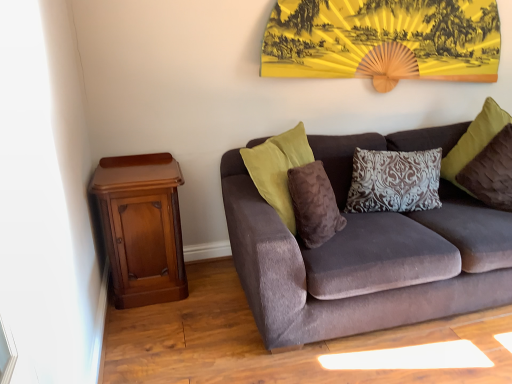
Question: Considering the relative sizes of brown fuzzy pillow at center, positioned as the first pillow in left-to-right order, and velvet brown couch at center in the image provided, is brown fuzzy pillow at center, positioned as the first pillow in left-to-right order, smaller than velvet brown couch at center?

Choices:
 (A) yes
 (B) no

Answer: (A)

Question: Is brown fuzzy pillow at center, positioned as the first pillow in left-to-right order, at the left side of velvet brown couch at center?

Choices:
 (A) no
 (B) yes

Answer: (B)

Question: Is brown fuzzy pillow at center, which ranks as the 3th pillow in right-to-left order, further to camera compared to velvet brown couch at center?

Choices:
 (A) yes
 (B) no

Answer: (A)

Question: Is brown fuzzy pillow at center, which ranks as the 3th pillow in right-to-left order, shorter than velvet brown couch at center?

Choices:
 (A) yes
 (B) no

Answer: (A)

Question: Is brown fuzzy pillow at center, which ranks as the 3th pillow in right-to-left order, next to velvet brown couch at center?

Choices:
 (A) yes
 (B) no

Answer: (B)

Question: Is brown fuzzy pillow at center, which ranks as the 3th pillow in right-to-left order, far from velvet brown couch at center?

Choices:
 (A) no
 (B) yes

Answer: (A)

Question: Is mahogany wood nightstand at left completely or partially inside velvet brown pillow at upper right, marked as the 1th pillow in a right-to-left arrangement?

Choices:
 (A) yes
 (B) no

Answer: (B)

Question: Is velvet brown pillow at upper right, marked as the 1th pillow in a right-to-left arrangement, completely or partially outside of mahogany wood nightstand at left?

Choices:
 (A) yes
 (B) no

Answer: (A)

Question: Is velvet brown pillow at upper right, marked as the 1th pillow in a right-to-left arrangement, smaller than mahogany wood nightstand at left?

Choices:
 (A) no
 (B) yes

Answer: (B)

Question: Is velvet brown pillow at upper right, marked as the 3th pillow in a left-to-right arrangement, facing away from mahogany wood nightstand at left?

Choices:
 (A) no
 (B) yes

Answer: (A)

Question: Is velvet brown pillow at upper right, marked as the 1th pillow in a right-to-left arrangement, directly adjacent to mahogany wood nightstand at left?

Choices:
 (A) yes
 (B) no

Answer: (B)

Question: Can you confirm if velvet brown pillow at upper right, marked as the 1th pillow in a right-to-left arrangement, is bigger than mahogany wood nightstand at left?

Choices:
 (A) yes
 (B) no

Answer: (B)

Question: Can mahogany wood nightstand at left be found inside velvet brown couch at center?

Choices:
 (A) yes
 (B) no

Answer: (B)